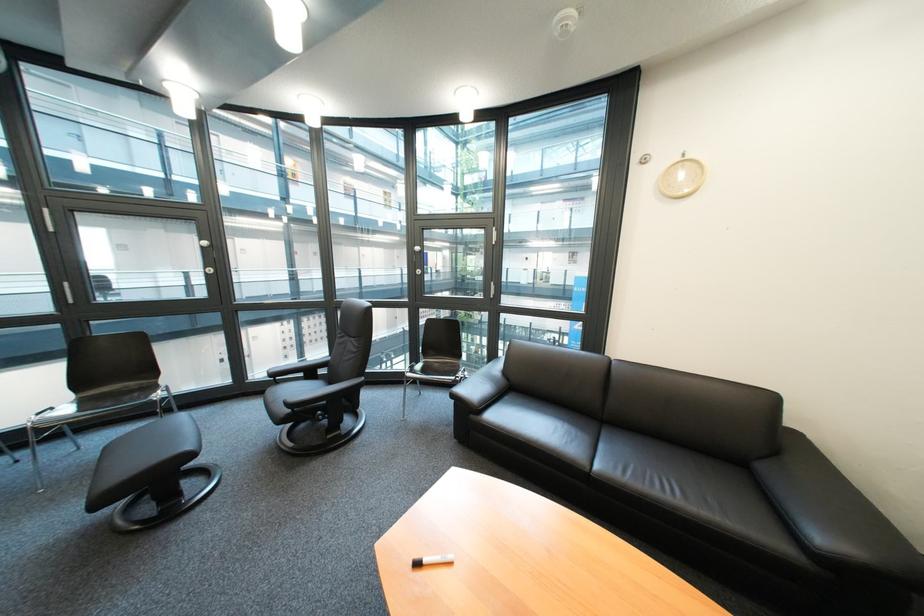
The height and width of the screenshot is (616, 924). Identify the location of white marker. (432, 560).